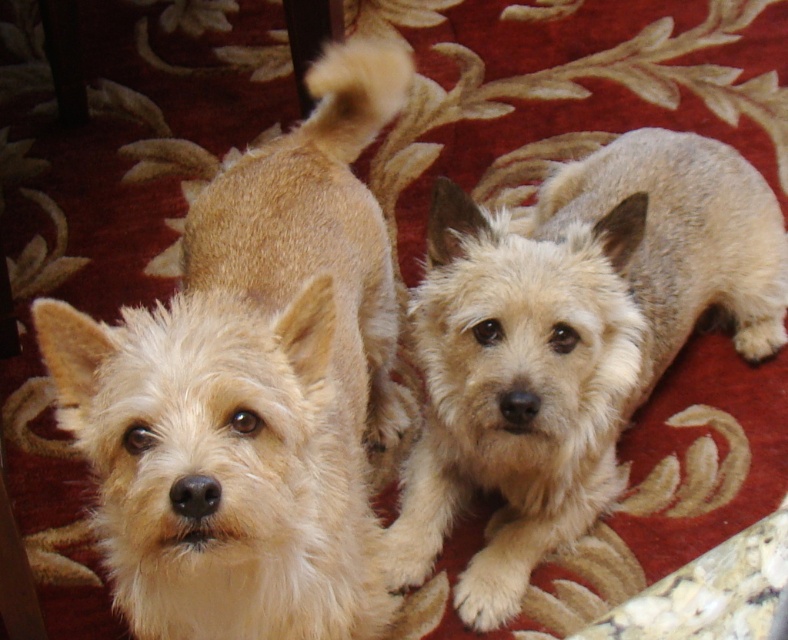
Question: Which point is farther from the camera taking this photo?

Choices:
 (A) (656, 237)
 (B) (374, 275)

Answer: (A)

Question: Among these points, which one is farthest from the camera?

Choices:
 (A) (400, 528)
 (B) (251, 486)

Answer: (A)

Question: Where is light beige fur at center located in relation to fuzzy beige dog at center in the image?

Choices:
 (A) below
 (B) above

Answer: (A)

Question: Can you confirm if light beige fur at center is positioned above fuzzy beige dog at center?

Choices:
 (A) no
 (B) yes

Answer: (A)

Question: Can you confirm if light beige fur at center is thinner than fuzzy beige dog at center?

Choices:
 (A) no
 (B) yes

Answer: (B)

Question: Which point is farther from the camera taking this photo?

Choices:
 (A) (456, 220)
 (B) (285, 323)

Answer: (A)